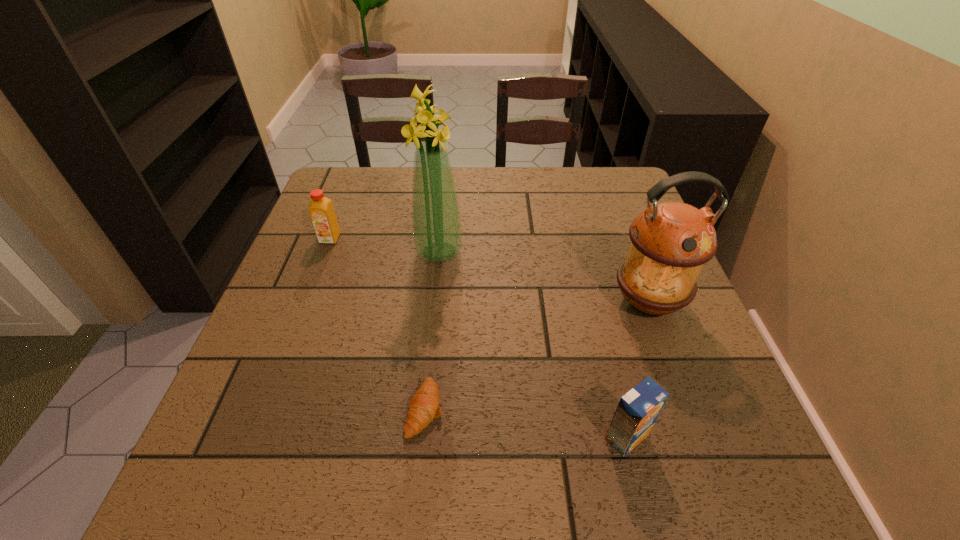
The image size is (960, 540). In order to click on free space located 0.130m on the front and back of the left orange_juice in this screenshot , I will do `click(313, 281)`.

Locate an element on the screen. The width and height of the screenshot is (960, 540). free space located 0.170m on the back of the fourth object from left to right is located at coordinates (602, 340).

At what (x,y) coordinates should I click in order to perform the action: click on free space located 0.300m on the back of the shortest object. Please return your answer as a coordinate pair (x, y). This screenshot has width=960, height=540. Looking at the image, I should click on (439, 271).

Identify the location of object present at the near edge. (637, 411).

The width and height of the screenshot is (960, 540). What are the coordinates of `object that is at the left edge` in the screenshot? It's located at (321, 211).

Locate an element on the screen. The width and height of the screenshot is (960, 540). object situated at the right edge is located at coordinates (670, 241).

Where is `vacant region at the far edge of the desktop`? vacant region at the far edge of the desktop is located at coordinates (522, 188).

You are a GUI agent. You are given a task and a screenshot of the screen. Output one action in this format:
    pyautogui.click(x=<x>, y=<y>)
    Task: Click on the free region at the left edge of the desktop
    The width and height of the screenshot is (960, 540).
    Given the screenshot: What is the action you would take?
    pyautogui.click(x=312, y=232)

I want to click on vacant area at the right edge, so click(675, 410).

The height and width of the screenshot is (540, 960). In the image, there is a desktop. Find the location of `free space at the near left corner`. free space at the near left corner is located at coordinates (193, 482).